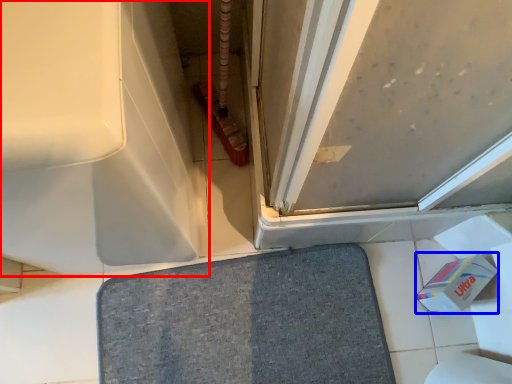
Question: Which of the following is the closest to the observer, bath (highlighted by a red box) or toilet paper (highlighted by a blue box)?

Choices:
 (A) bath
 (B) toilet paper

Answer: (A)